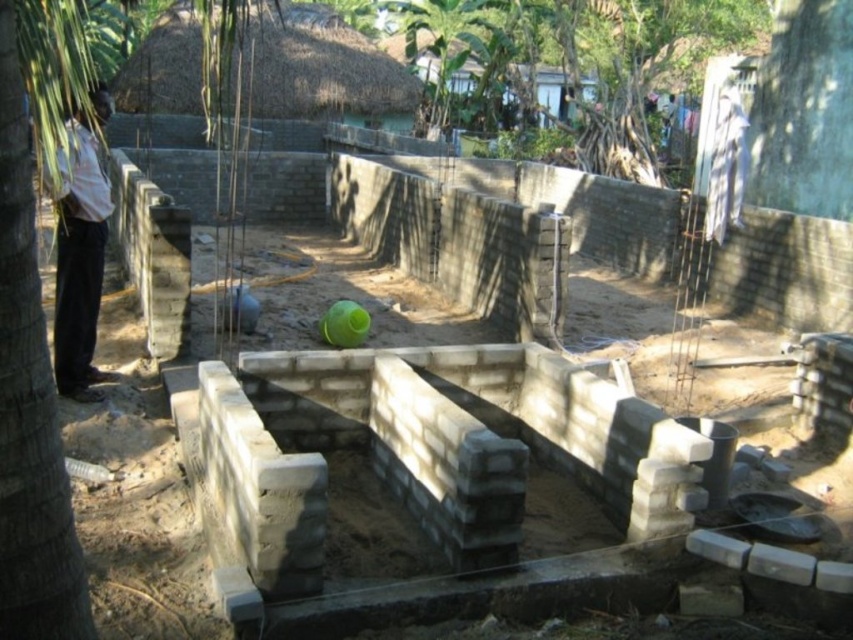
Can you confirm if gray concrete foundation at center is shorter than white shirt at left?

Correct, gray concrete foundation at center is not as tall as white shirt at left.

Who is more forward, [404,449] or [97,276]?

Point [404,449]

Locate an element on the screen. gray concrete foundation at center is located at coordinates (427, 451).

Where is `gray concrete foundation at center`? The image size is (853, 640). gray concrete foundation at center is located at coordinates (427, 451).

Which of these two, green leafy tree at left or white shirt at left, stands shorter?

Standing shorter between the two is green leafy tree at left.

Can you confirm if green leafy tree at left is shorter than white shirt at left?

Indeed, green leafy tree at left has a lesser height compared to white shirt at left.

Who is more distant from viewer, (62, 515) or (74, 125)?

The point (74, 125) is more distant.

I want to click on green leafy tree at left, so click(x=33, y=330).

Is the position of gray concrete foundation at center more distant than that of green leafy tree at left?

Yes, it is.

The height and width of the screenshot is (640, 853). What do you see at coordinates (427, 451) in the screenshot? I see `gray concrete foundation at center` at bounding box center [427, 451].

Which is behind, point (283, 512) or point (9, 442)?

The point (283, 512) is more distant.

The image size is (853, 640). I want to click on gray concrete foundation at center, so click(x=427, y=451).